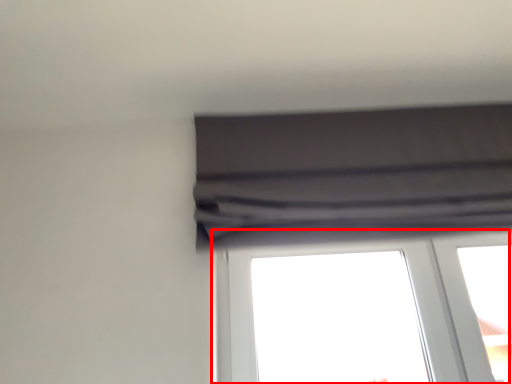
Question: From the image's perspective, what is the correct spatial positioning of window (annotated by the red box) in reference to curtain?

Choices:
 (A) above
 (B) below

Answer: (B)